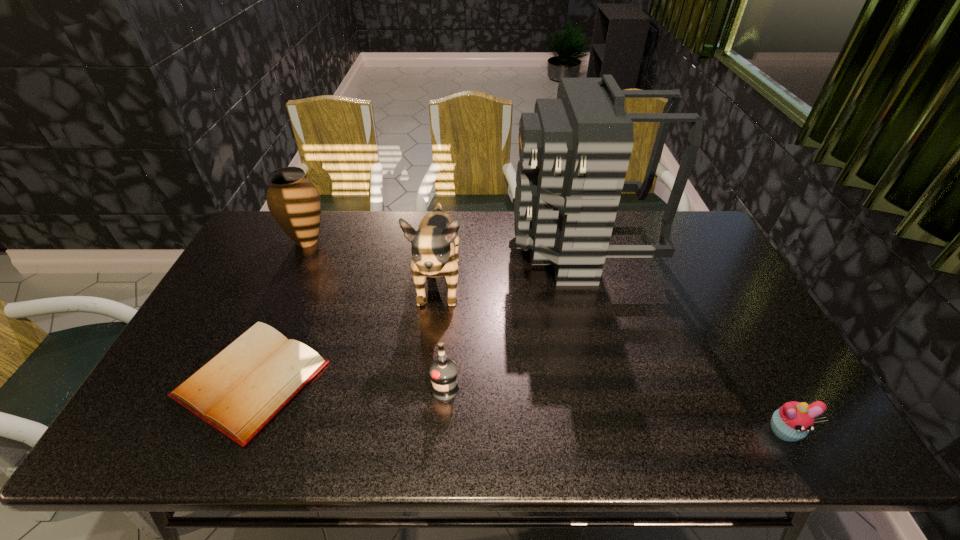
Locate an element on the screen. The image size is (960, 540). free space located 0.080m on the front compartment of the backpack is located at coordinates (489, 247).

Find the location of a particular element. The image size is (960, 540). free space located at the face of the puppy is located at coordinates (424, 427).

Locate an element on the screen. The width and height of the screenshot is (960, 540). free location located on the right of the third tallest object is located at coordinates (418, 241).

Locate an element on the screen. vacant space located on the front label of the vodka is located at coordinates (442, 431).

The image size is (960, 540). Find the location of `free space located 0.170m on the right of the Bible`. free space located 0.170m on the right of the Bible is located at coordinates (392, 379).

This screenshot has height=540, width=960. What are the coordinates of `backpack located at the far edge` in the screenshot? It's located at (574, 151).

Image resolution: width=960 pixels, height=540 pixels. Identify the location of puppy at the far edge. (434, 249).

The image size is (960, 540). I want to click on urn present at the far edge, so click(293, 200).

I want to click on cupcake that is positioned at the near edge, so click(x=792, y=421).

In order to click on Bible present at the near edge in this screenshot , I will do (x=239, y=391).